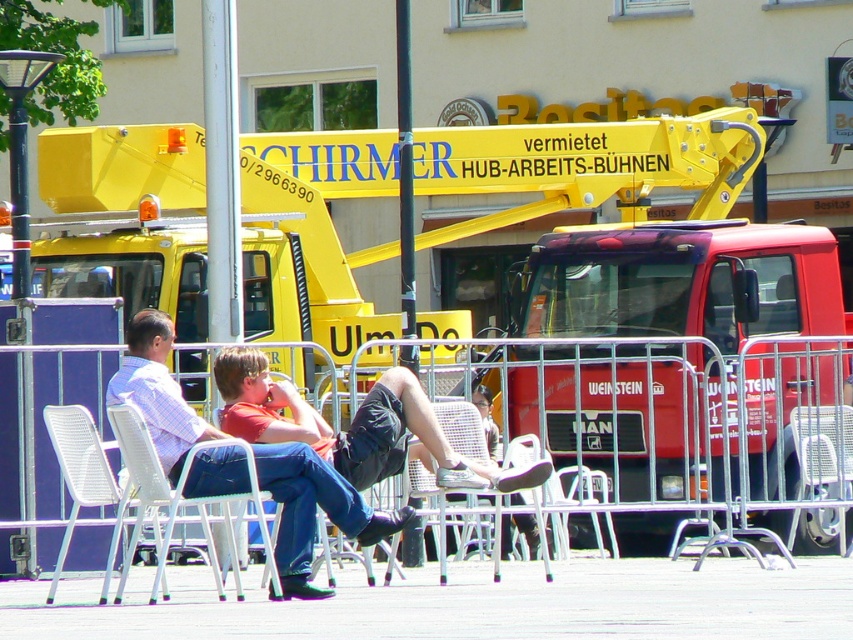
Who is higher up, denim jeans at center or white plastic chair at lower left?

denim jeans at center

Does denim jeans at center come in front of white plastic chair at lower left?

That is False.

What do you see at coordinates (314, 508) in the screenshot? I see `denim jeans at center` at bounding box center [314, 508].

You are a GUI agent. You are given a task and a screenshot of the screen. Output one action in this format:
    pyautogui.click(x=<x>, y=<y>)
    Task: Click on the denim jeans at center
    This screenshot has height=640, width=853.
    Given the screenshot: What is the action you would take?
    pyautogui.click(x=314, y=508)

Describe the element at coordinates (314, 508) in the screenshot. I see `denim jeans at center` at that location.

Is point (189, 424) positioned before point (469, 436)?

Yes, it is in front of point (469, 436).

Between point (378, 536) and point (393, 554), which one is positioned in front?

Point (378, 536) is in front.

This screenshot has width=853, height=640. I want to click on denim jeans at center, so click(x=314, y=508).

Measure the distance between yellow metallic fire truck at center and white plastic chair at lower left.

12.56 meters

Where is `yellow metallic fire truck at center`? The image size is (853, 640). yellow metallic fire truck at center is located at coordinates coord(590,164).

This screenshot has width=853, height=640. Identify the location of yellow metallic fire truck at center. (590, 164).